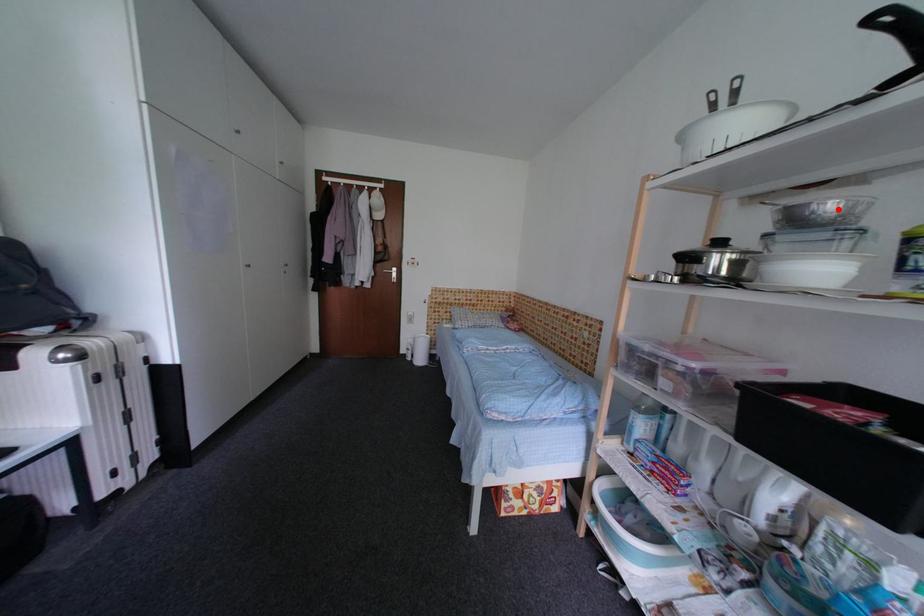
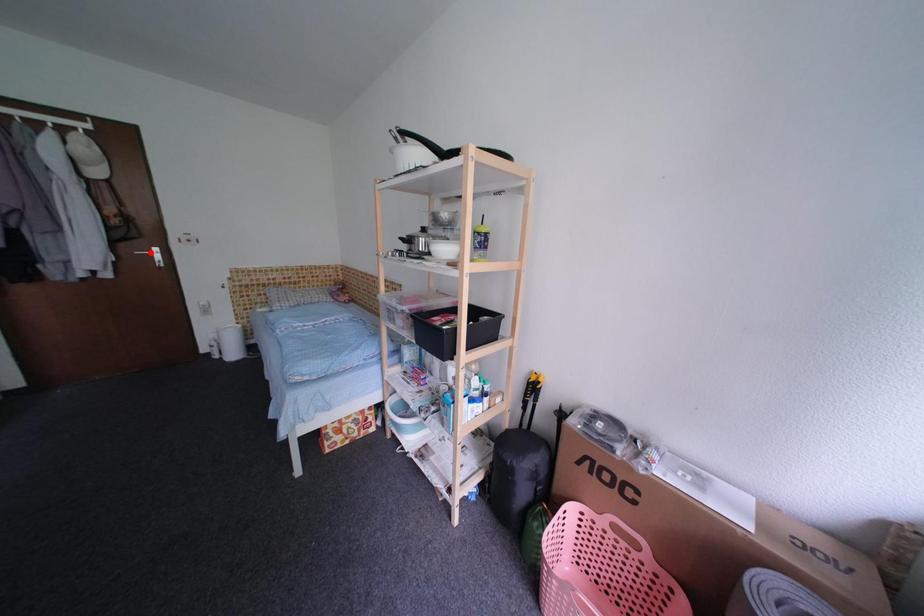
I am providing you with two images of the same scene from different viewpoints. A red point is marked on the first image and another point is marked on the second image. Does the point marked in image1 correspond to the same location as the one in image2?

No